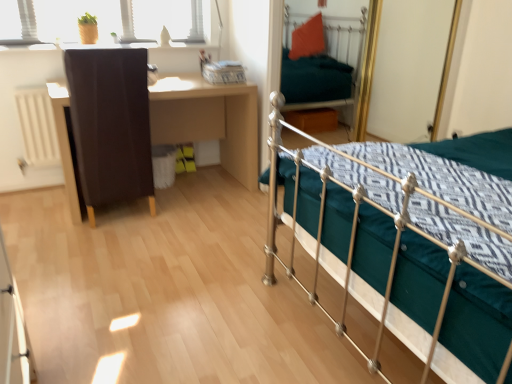
Question: In the image, is brown wooden desk at left positioned in front of or behind matte brown cabinet at left?

Choices:
 (A) front
 (B) behind

Answer: (B)

Question: Considering the positions of brown wooden desk at left and matte brown cabinet at left in the image, is brown wooden desk at left bigger or smaller than matte brown cabinet at left?

Choices:
 (A) big
 (B) small

Answer: (A)

Question: Considering the real-world distances, which object is farthest from the matte brown cabinet at left?

Choices:
 (A) metallic green bed at center
 (B) brown wooden desk at left

Answer: (A)

Question: Considering the real-world distances, which object is farthest from the brown wooden desk at left?

Choices:
 (A) metallic green bed at center
 (B) matte brown cabinet at left

Answer: (A)